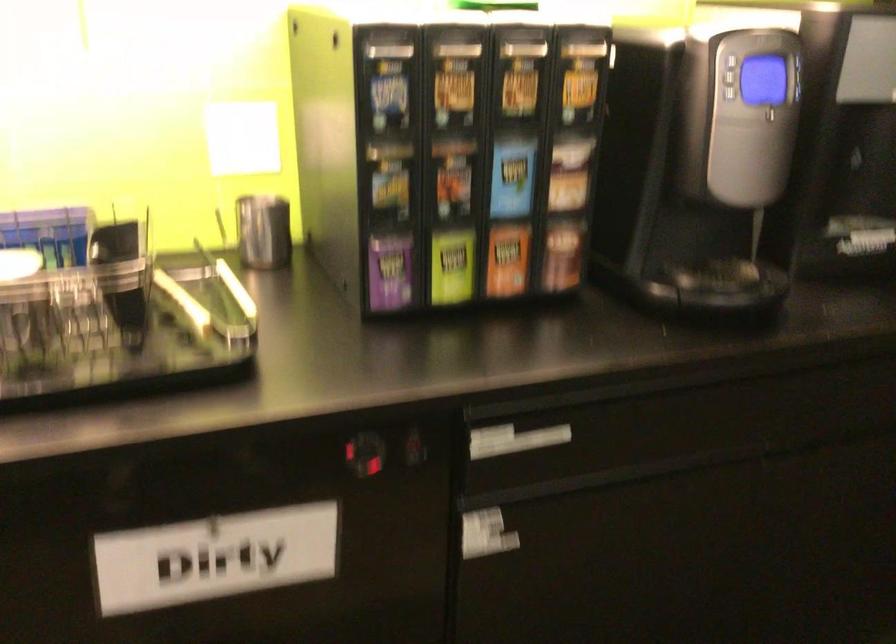
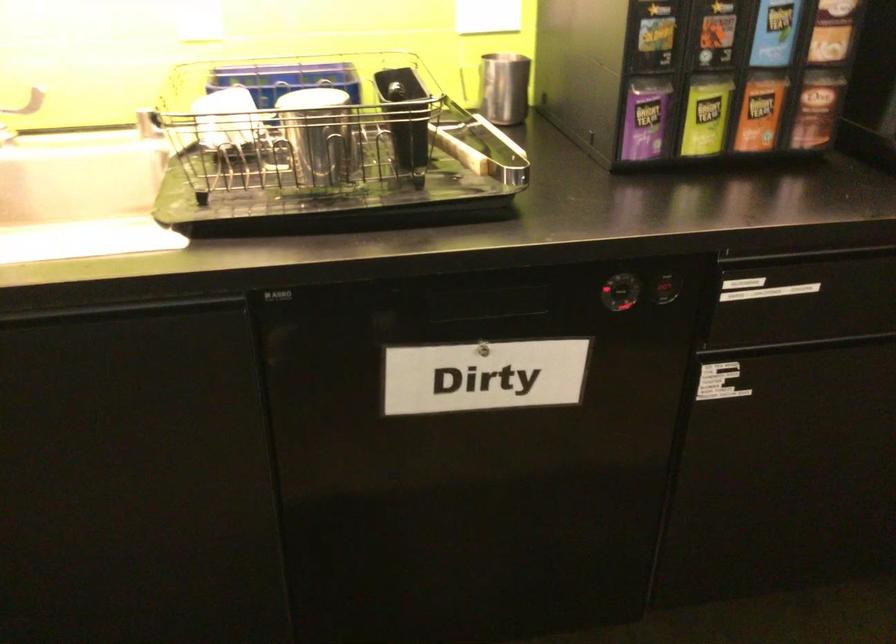
In the second image, find the point that corresponds to the point at 389,268 in the first image.

(645, 118)